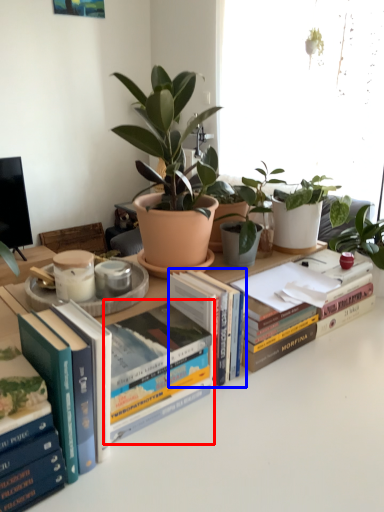
Question: Which point is closer to the camera, book (highlighted by a red box) or book (highlighted by a blue box)?

Choices:
 (A) book
 (B) book

Answer: (A)